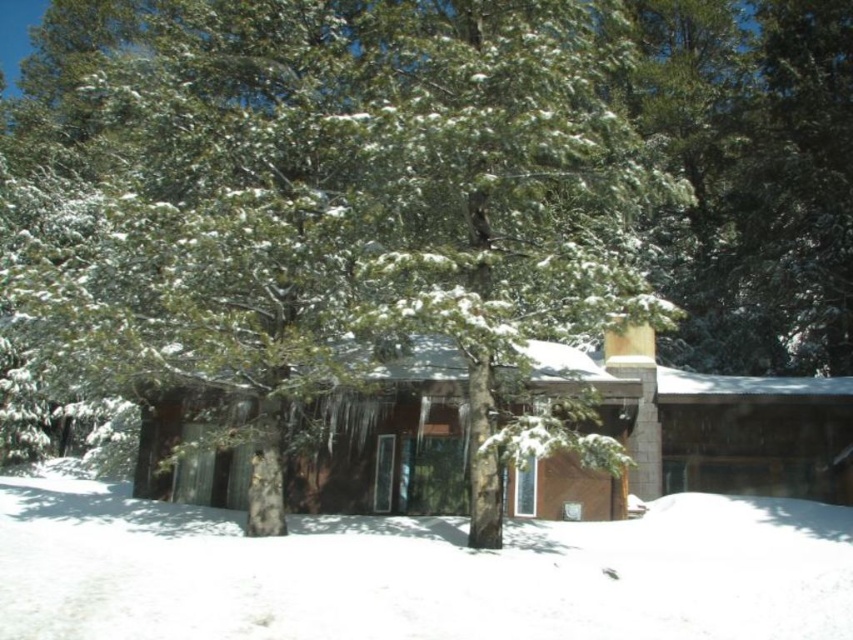
Who is lower down, white fluffy snow at lower center or brown wood cabin at center?

white fluffy snow at lower center

Can you confirm if white fluffy snow at lower center is positioned to the right of brown wood cabin at center?

No, white fluffy snow at lower center is not to the right of brown wood cabin at center.

Is point (184, 564) positioned in front of point (561, 490)?

Yes, it is in front of point (561, 490).

Image resolution: width=853 pixels, height=640 pixels. Find the location of `white fluffy snow at lower center`. white fluffy snow at lower center is located at coordinates (416, 572).